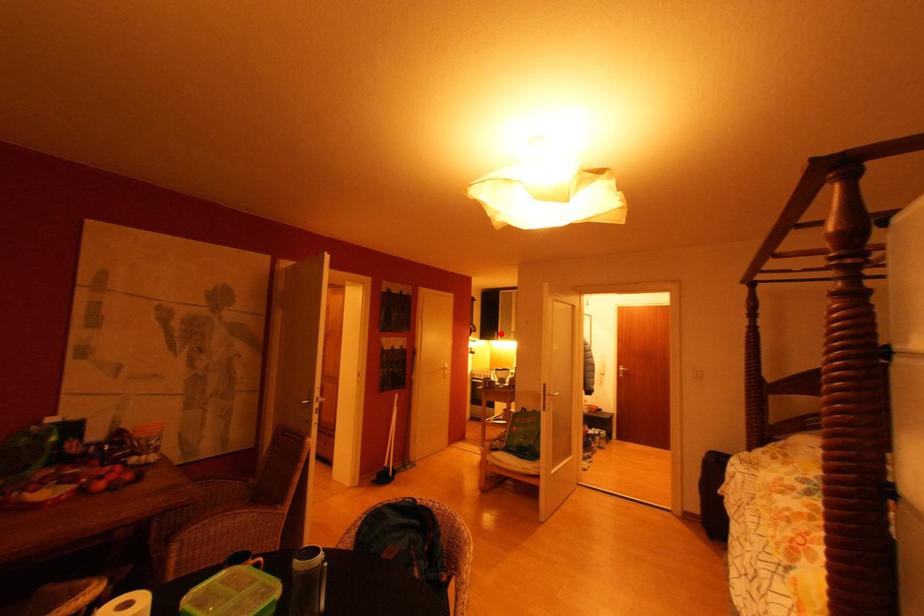
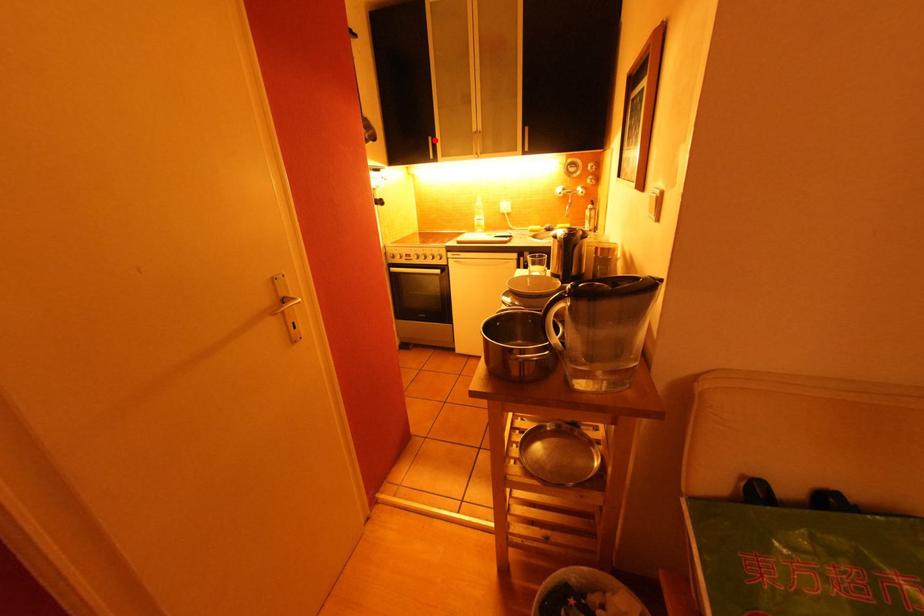
I am providing you with two images of the same scene from different viewpoints. A red point is marked on the first image and another point is marked on the second image. Do the highlighted points in image1 and image2 indicate the same real-world spot?

Yes